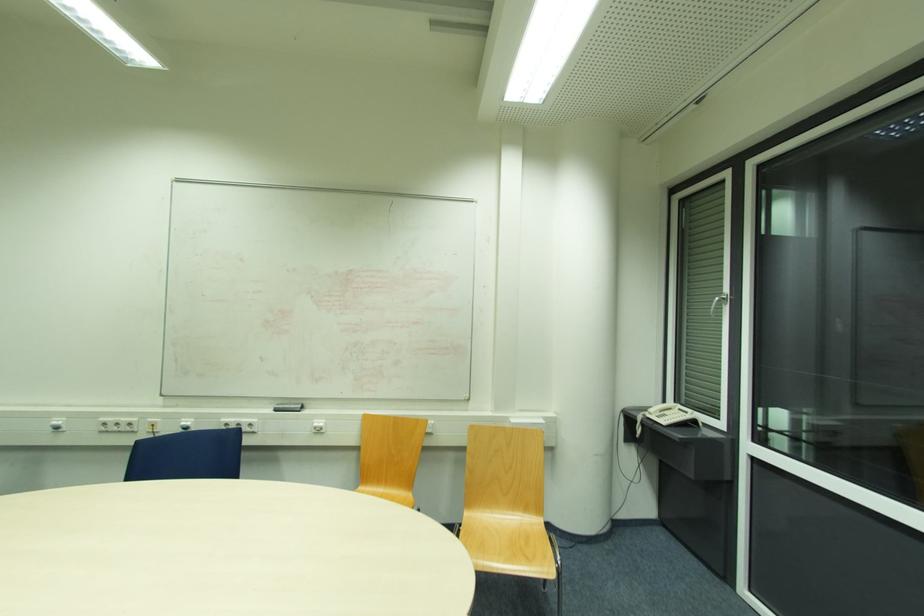
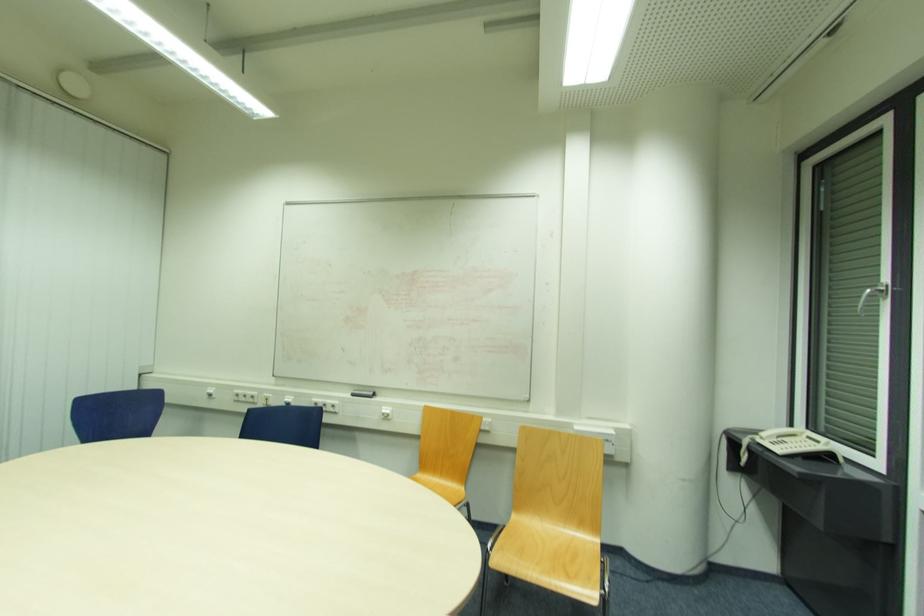
Find the pixel in the second image that matches pixel 727 305 in the first image.

(883, 297)